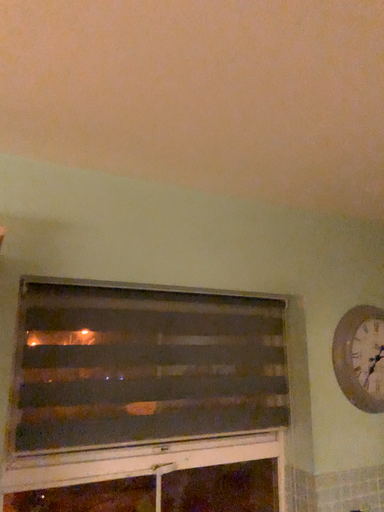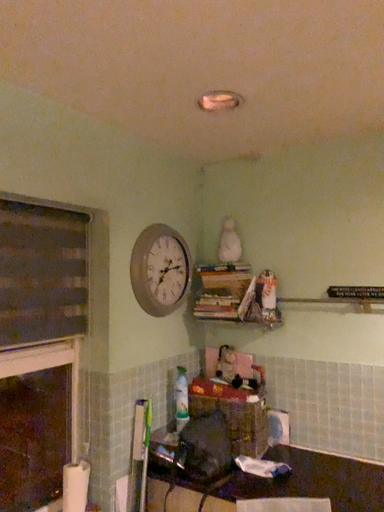
Question: Which way did the camera rotate in the video?

Choices:
 (A) rotated upward
 (B) rotated downward

Answer: (B)